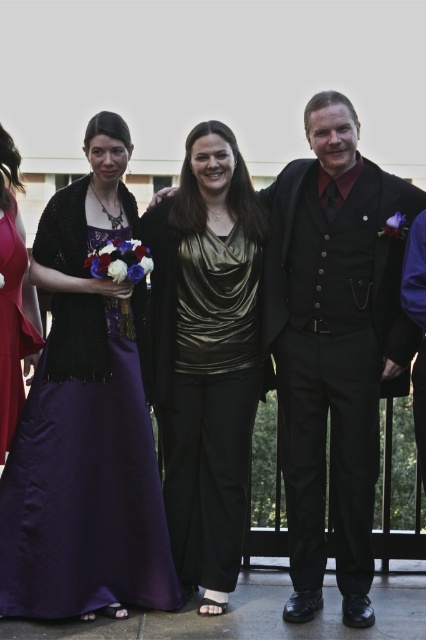
Question: Based on their relative distances, which object is nearer to the shiny black vest at center?

Choices:
 (A) satin purple dress at left
 (B) shiny gold blouse at center

Answer: (B)

Question: Which point is closer to the camera?

Choices:
 (A) (204, 173)
 (B) (14, 234)
 (C) (129, 403)

Answer: (C)

Question: Which object is closer to the camera taking this photo?

Choices:
 (A) shiny gold blouse at center
 (B) matte purple dress at left
 (C) satin purple dress at left

Answer: (C)

Question: Is satin purple dress at left positioned behind shiny gold blouse at center?

Choices:
 (A) yes
 (B) no

Answer: (B)

Question: Is the position of satin purple dress at left less distant than that of shiny black vest at center?

Choices:
 (A) yes
 (B) no

Answer: (A)

Question: Is shiny gold blouse at center behind matte purple dress at left?

Choices:
 (A) yes
 (B) no

Answer: (B)